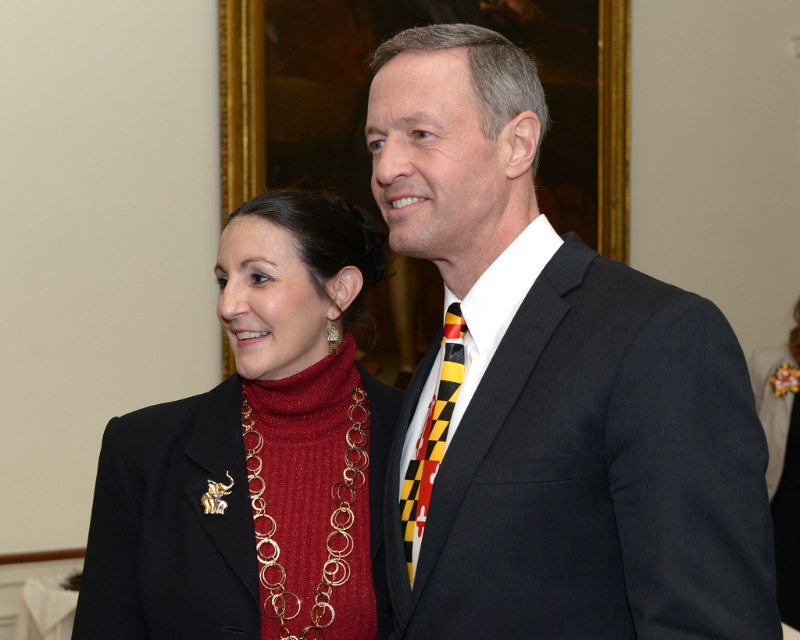
Question: Which object appears closest to the camera in this image?

Choices:
 (A) velvet burgundy dress at right
 (B) shiny gold necklace at center

Answer: (B)

Question: Among these points, which one is nearest to the camera?

Choices:
 (A) (796, 362)
 (B) (430, 452)

Answer: (B)

Question: In this image, where is black suit at center located relative to shiny gold necklace at center?

Choices:
 (A) above
 (B) below

Answer: (A)

Question: Which point is farther from the camera taking this photo?

Choices:
 (A) (420, 502)
 (B) (230, 529)

Answer: (B)

Question: Does black suit at center have a larger size compared to yellow and black striped tie at center?

Choices:
 (A) yes
 (B) no

Answer: (A)

Question: Can you confirm if shiny gold necklace at center is positioned to the right of velvet burgundy dress at right?

Choices:
 (A) yes
 (B) no

Answer: (B)